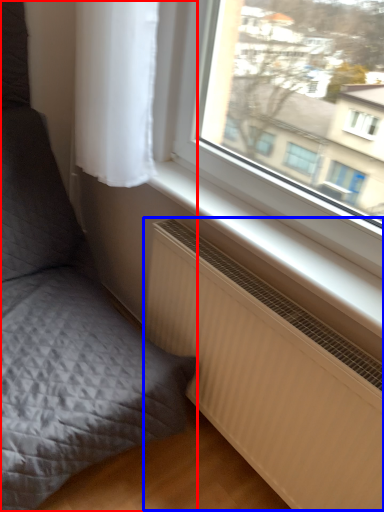
Question: Among these objects, which one is nearest to the camera, furniture (highlighted by a red box) or radiator (highlighted by a blue box)?

Choices:
 (A) furniture
 (B) radiator

Answer: (A)